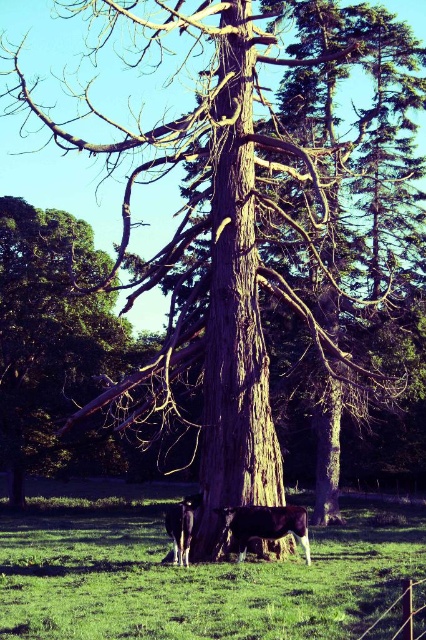
Can you confirm if green grass at lower center is positioned above black glossy cow at center?

No, green grass at lower center is not above black glossy cow at center.

Which is behind, point (221, 589) or point (252, 536)?

Positioned behind is point (252, 536).

Identify the location of green grass at lower center. The height and width of the screenshot is (640, 426). (190, 570).

Can you confirm if green grass at lower center is taller than brown glossy cow at lower center?

Yes.

Does point (132, 595) come in front of point (181, 563)?

Yes, it is.

The width and height of the screenshot is (426, 640). Describe the element at coordinates (190, 570) in the screenshot. I see `green grass at lower center` at that location.

The height and width of the screenshot is (640, 426). Identify the location of green grass at lower center. (190, 570).

Does point (28, 433) come behind point (247, 531)?

Yes, point (28, 433) is behind point (247, 531).

Does green leafy tree at left have a larger size compared to black glossy cow at center?

Yes, green leafy tree at left is bigger than black glossy cow at center.

Where is `green leafy tree at left`? The image size is (426, 640). green leafy tree at left is located at coordinates (48, 332).

The image size is (426, 640). I want to click on green leafy tree at left, so click(x=48, y=332).